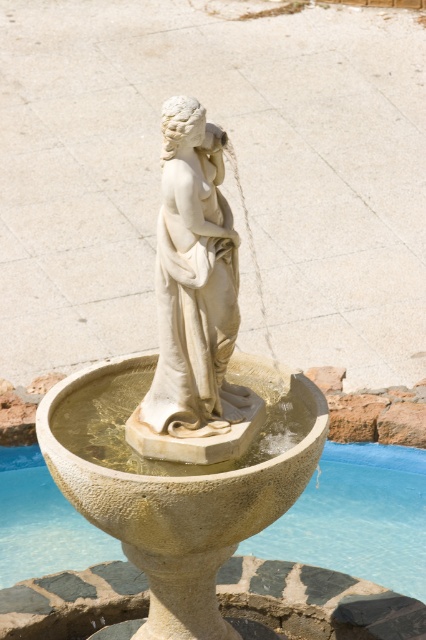
Question: Is white stone statue at center below clear water at fountain center?

Choices:
 (A) yes
 (B) no

Answer: (B)

Question: Which point is farther from the camera taking this photo?

Choices:
 (A) (207, 125)
 (B) (373, 532)
 (C) (166, 113)

Answer: (B)

Question: Which point appears farthest from the camera in this image?

Choices:
 (A) (201, 160)
 (B) (325, 541)

Answer: (B)

Question: Considering the relative positions of white stone statue at center and clear water at fountain center in the image provided, where is white stone statue at center located with respect to clear water at fountain center?

Choices:
 (A) right
 (B) left

Answer: (B)

Question: Can you confirm if white stone statue at center is positioned to the right of clear water at fountain center?

Choices:
 (A) yes
 (B) no

Answer: (B)

Question: Which point is closer to the camera taking this photo?

Choices:
 (A) (17, 554)
 (B) (184, 324)
 (C) (267, 365)

Answer: (B)